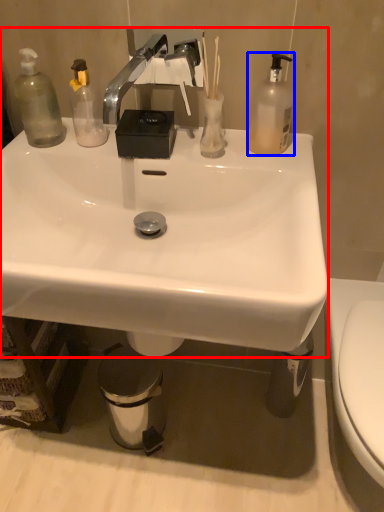
Question: Which point is closer to the camera, sink (highlighted by a red box) or bottle (highlighted by a blue box)?

Choices:
 (A) sink
 (B) bottle

Answer: (A)